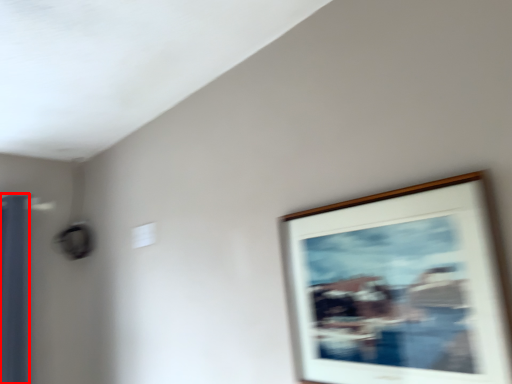
Question: From the image's perspective, considering the relative positions of curtain (annotated by the red box) and picture frame in the image provided, where is curtain (annotated by the red box) located with respect to the staircase?

Choices:
 (A) below
 (B) above

Answer: (A)